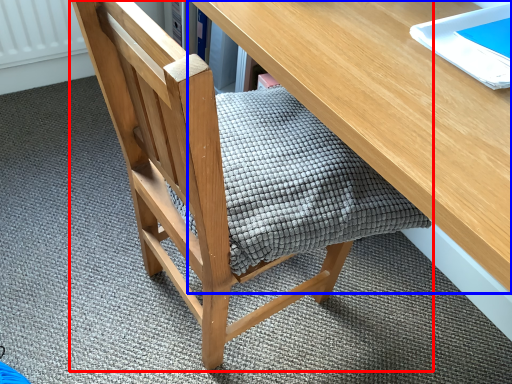
Question: Among these objects, which one is nearest to the camera, chair (highlighted by a red box) or desk (highlighted by a blue box)?

Choices:
 (A) chair
 (B) desk

Answer: (B)